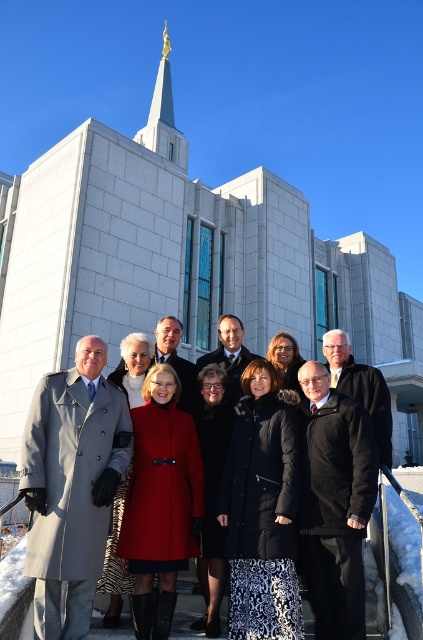
You are standing at the bottom of the steps leading to the building and want to take a photo of the red wool coat at center. Which direction should you move to get a clear view of it?

The red wool coat at center is located at point [136,353], so you should move towards the center of the steps to get a clear view of it.

You are standing at the bottom of the steps leading to the white stone church at center and the gold metallic spire at upper center. Which object is positioned to the right side from your viewpoint?

The white stone church at center is positioned to the right of the gold metallic spire at upper center, so the white stone church at center is on the right side from your viewpoint.

From the picture: You are standing at the center of the image. Which direction should you move to face the white stone church at center?

The white stone church at center is already at the center of the image, so you are already facing it.